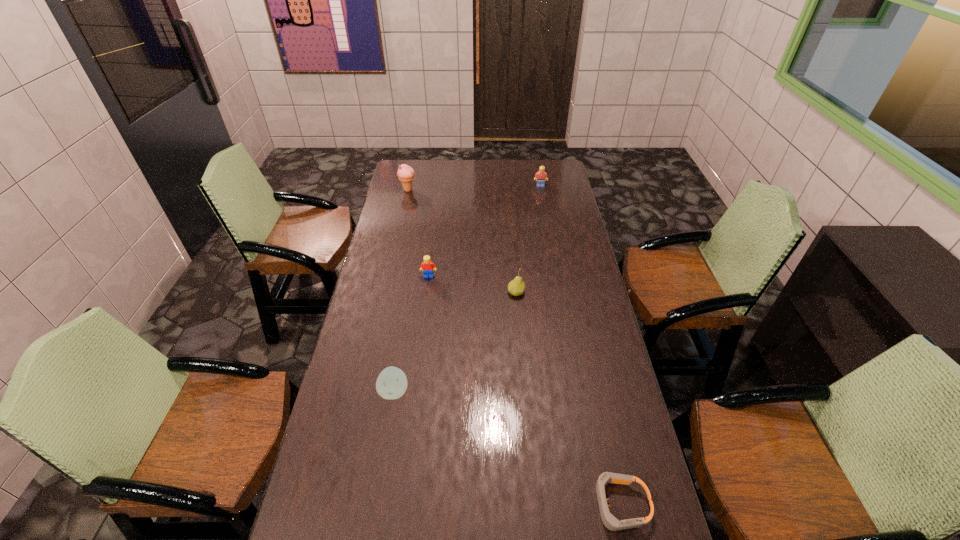
Where is `Lego that is at the right edge`? Lego that is at the right edge is located at coordinates (540, 176).

You are a GUI agent. You are given a task and a screenshot of the screen. Output one action in this format:
    pyautogui.click(x=<x>, y=<y>)
    Task: Click on the goggles at the right edge
    The height and width of the screenshot is (540, 960).
    Given the screenshot: What is the action you would take?
    pyautogui.click(x=610, y=522)

In the image, there is a desktop. At what (x,y) coordinates should I click in order to perform the action: click on vacant space at the far edge. Please return your answer as a coordinate pair (x, y). This screenshot has width=960, height=540. Looking at the image, I should click on (464, 176).

Find the location of `blank space at the left edge of the desktop`. blank space at the left edge of the desktop is located at coordinates (401, 229).

You are a GUI agent. You are given a task and a screenshot of the screen. Output one action in this format:
    pyautogui.click(x=<x>, y=<y>)
    Task: Click on the free point at the right edge
    The height and width of the screenshot is (540, 960).
    Given the screenshot: What is the action you would take?
    click(x=580, y=276)

I want to click on vacant area between the tallest object and the farther Lego, so click(474, 188).

Locate an element on the screen. free space between the right Lego and the nearest object is located at coordinates [x=580, y=345].

I want to click on free area in between the farther Lego and the fourth farthest object, so click(528, 239).

You are a GUI agent. You are given a task and a screenshot of the screen. Output one action in this format:
    pyautogui.click(x=<x>, y=<y>)
    Task: Click on the unoccupied area between the apple and the nearest object
    The width and height of the screenshot is (960, 540).
    Given the screenshot: What is the action you would take?
    pyautogui.click(x=507, y=448)

Identify the location of free area in between the shortest object and the third object from right to left. (567, 399).